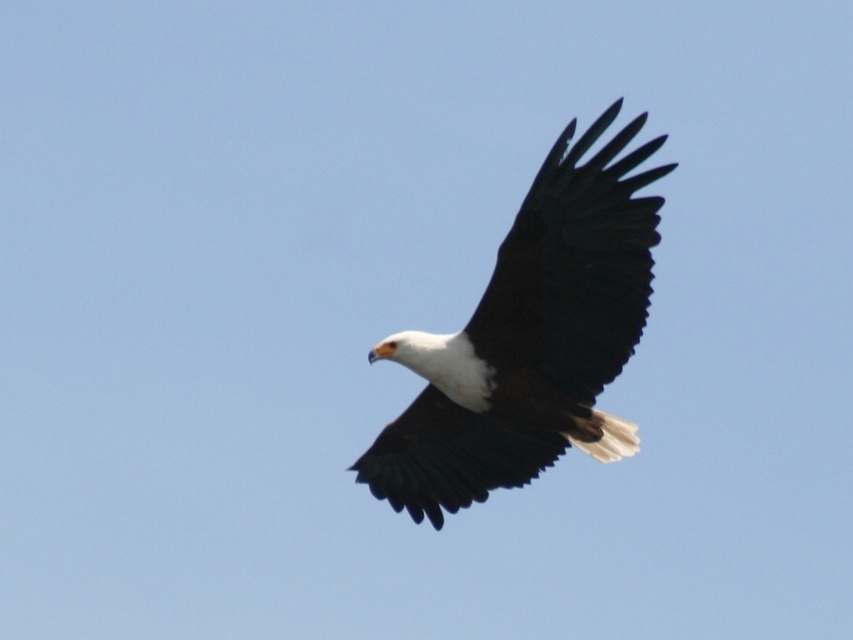
You are a photographer trying to capture the white matte eagle at center. Based on the eagle position at point 0.530, 0.623, where should you aim your camera to ensure the eagle is centered in your shot?

The white matte eagle at center is already positioned at the coordinates (x=531, y=339), so aiming your camera at that point will ensure the eagle is centered in your shot.

You are a photographer trying to capture the bald eagle in flight. You notice a point marked at coordinates (531, 339). Where is this point located in relation to the white matte eagle at center?

The point (531, 339) is located at the center of the white matte eagle at center, as the description states that the point marks the eagle.

You are observing a bald eagle in flight against a clear blue sky. You notice two points labeled as point (537, 221) and point (492, 337) on the eagle. Which point is closer to your viewpoint?

Point (537, 221) is closer to the camera than point (492, 337).